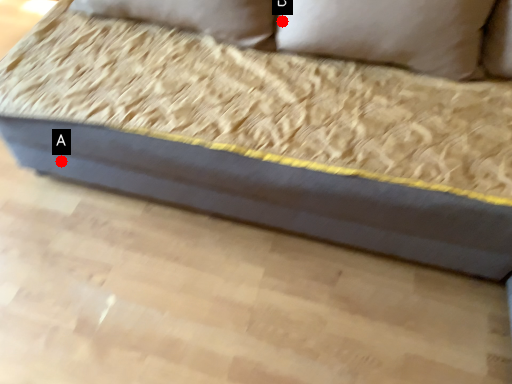
Question: Two points are circled on the image, labeled by A and B beside each circle. Which point is closer to the camera taking this photo?

Choices:
 (A) A is closer
 (B) B is closer

Answer: (B)